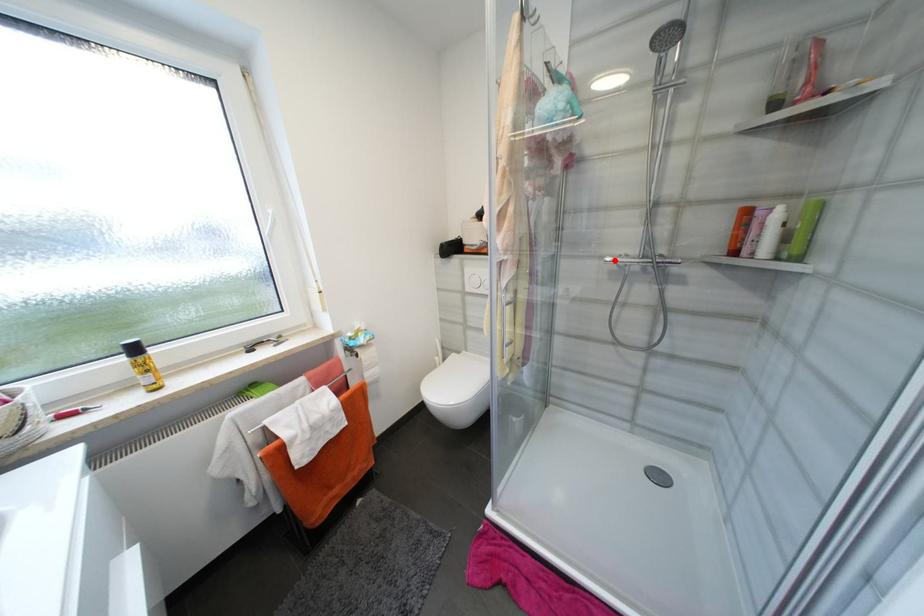
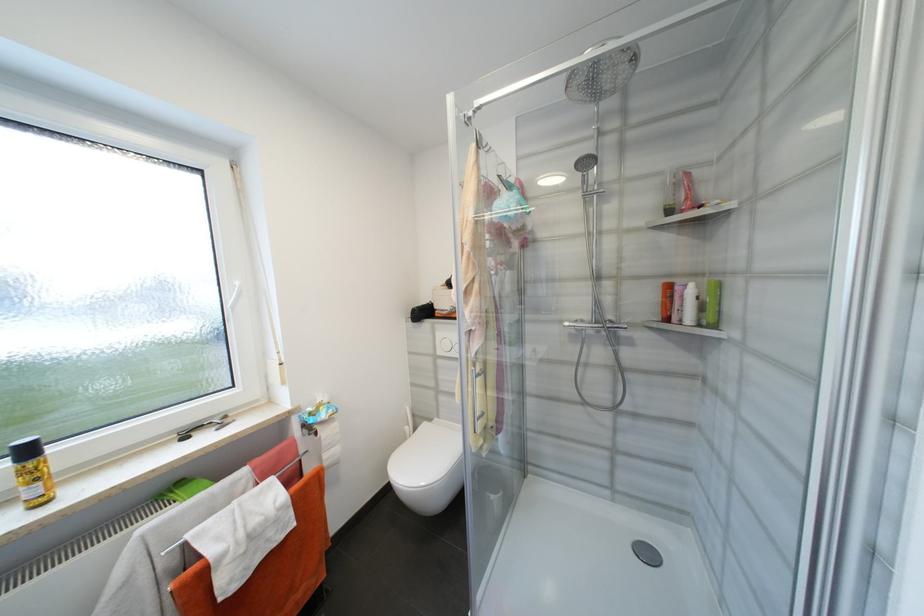
Question: I am providing you with two images of the same scene from different viewpoints. A red point is shown in image1. For the corresponding object point in image2, is it positioned nearer or farther from the camera?

Choices:
 (A) Nearer
 (B) Farther

Answer: (B)